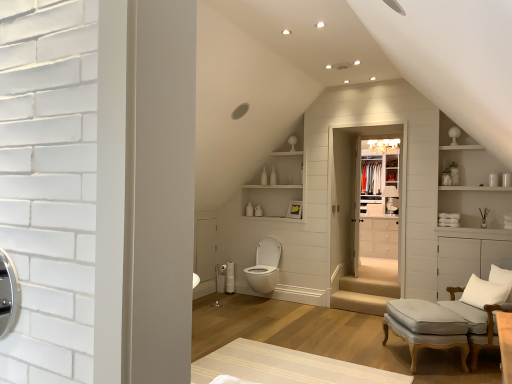
Question: Should I look upward or downward to see beige striped rug at center?

Choices:
 (A) down
 (B) up

Answer: (A)

Question: From a real-world perspective, is white glossy cabinet at center on light gray fabric chair at lower right?

Choices:
 (A) no
 (B) yes

Answer: (B)

Question: Can you confirm if white glossy cabinet at center is taller than light gray fabric chair at lower right?

Choices:
 (A) no
 (B) yes

Answer: (A)

Question: Is white glossy cabinet at center in front of light gray fabric chair at lower right?

Choices:
 (A) no
 (B) yes

Answer: (A)

Question: From a real-world perspective, is white glossy cabinet at center below light gray fabric chair at lower right?

Choices:
 (A) yes
 (B) no

Answer: (B)

Question: Is white glossy cabinet at center at the right side of light gray fabric chair at lower right?

Choices:
 (A) yes
 (B) no

Answer: (A)

Question: From the image's perspective, is white glossy cabinet at center beneath light gray fabric chair at lower right?

Choices:
 (A) yes
 (B) no

Answer: (B)

Question: Can you see white glossy cabinet at upper right touching light gray fabric chair at lower right?

Choices:
 (A) yes
 (B) no

Answer: (B)

Question: Would you say white glossy cabinet at upper right is outside light gray fabric chair at lower right?

Choices:
 (A) no
 (B) yes

Answer: (B)

Question: Is white glossy cabinet at upper right positioned in front of light gray fabric chair at lower right?

Choices:
 (A) yes
 (B) no

Answer: (B)

Question: From a real-world perspective, is white glossy cabinet at upper right on top of light gray fabric chair at lower right?

Choices:
 (A) no
 (B) yes

Answer: (B)

Question: From the image's perspective, is white glossy cabinet at upper right below light gray fabric chair at lower right?

Choices:
 (A) yes
 (B) no

Answer: (B)

Question: Is white glossy cabinet at upper right turned away from light gray fabric chair at lower right?

Choices:
 (A) yes
 (B) no

Answer: (B)

Question: Considering the relative sizes of light gray fabric stool at lower right and white soft cushion at lower right in the image provided, is light gray fabric stool at lower right smaller than white soft cushion at lower right?

Choices:
 (A) no
 (B) yes

Answer: (A)